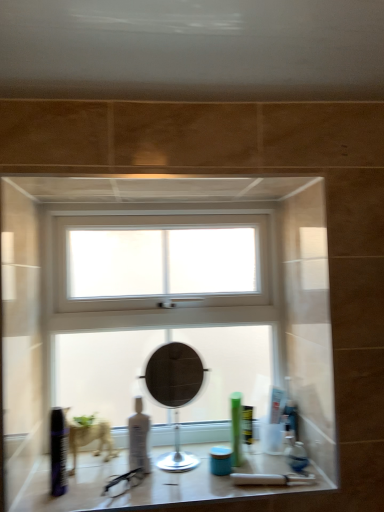
This screenshot has width=384, height=512. Find the location of `vacant area in front of matte black mirror at center`. vacant area in front of matte black mirror at center is located at coordinates (181, 485).